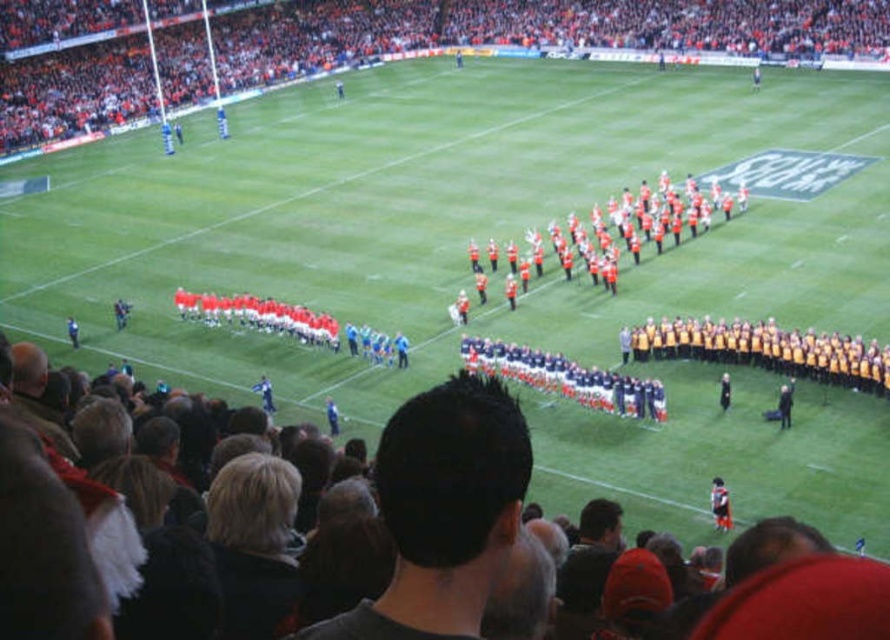
Image resolution: width=890 pixels, height=640 pixels. What do you see at coordinates (443, 509) in the screenshot?
I see `dark hair at center` at bounding box center [443, 509].

Is dark hair at center to the right of orange reflective uniforms at center from the viewer's perspective?

Incorrect, dark hair at center is not on the right side of orange reflective uniforms at center.

Between point (520, 416) and point (646, 195), which one is positioned behind?

The point (646, 195) is behind.

Identify the location of dark hair at center. The width and height of the screenshot is (890, 640). (443, 509).

Does orange fabric crowd at upper left have a lesser width compared to orange reflective uniforms at center?

Incorrect, orange fabric crowd at upper left's width is not less than orange reflective uniforms at center's.

Does orange fabric crowd at upper left have a larger size compared to orange reflective uniforms at center?

Correct, orange fabric crowd at upper left is larger in size than orange reflective uniforms at center.

You are a GUI agent. You are given a task and a screenshot of the screen. Output one action in this format:
    pyautogui.click(x=<x>, y=<y>)
    Task: Click on the orange fabric crowd at upper left
    This screenshot has height=640, width=890.
    Given the screenshot: What is the action you would take?
    pyautogui.click(x=535, y=29)

How distant is orange fabric crowd at upper left from dark hair at center?

orange fabric crowd at upper left and dark hair at center are 111.86 meters apart.

Is point (181, 33) closer to camera compared to point (482, 458)?

No, it is behind (482, 458).

Where is `orange fabric crowd at upper left`? The image size is (890, 640). orange fabric crowd at upper left is located at coordinates (535, 29).